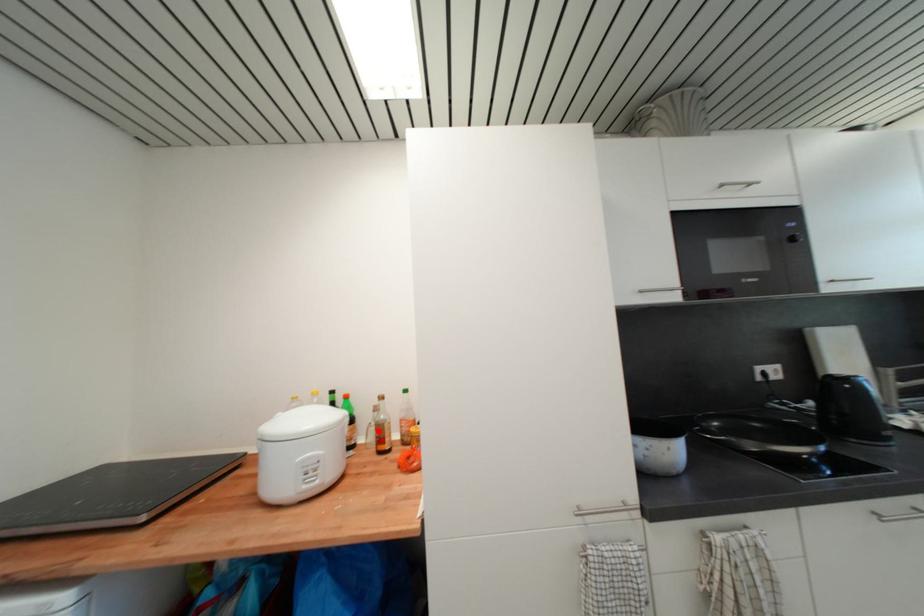
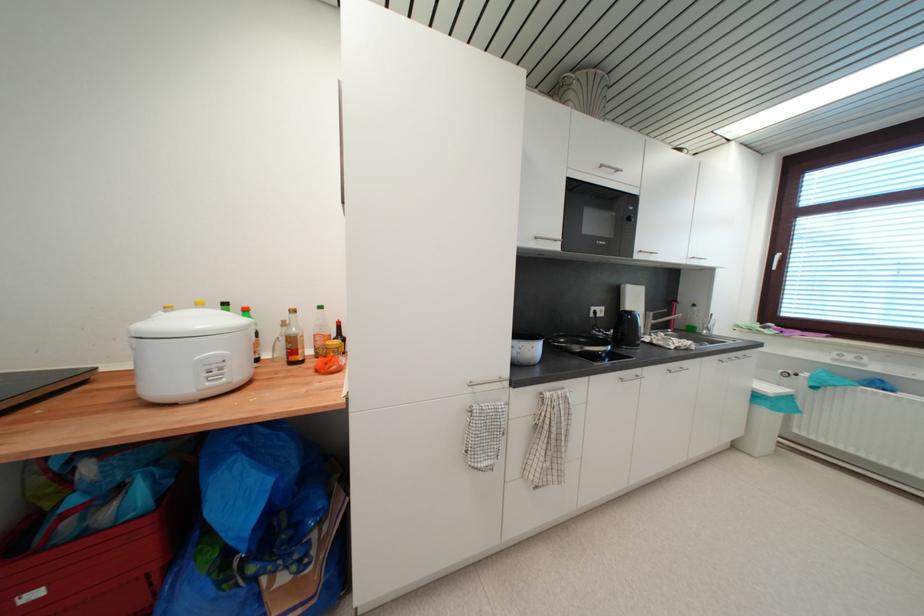
Locate, in the second image, the point that corresponds to the highlighted location in the first image.

(287, 344)